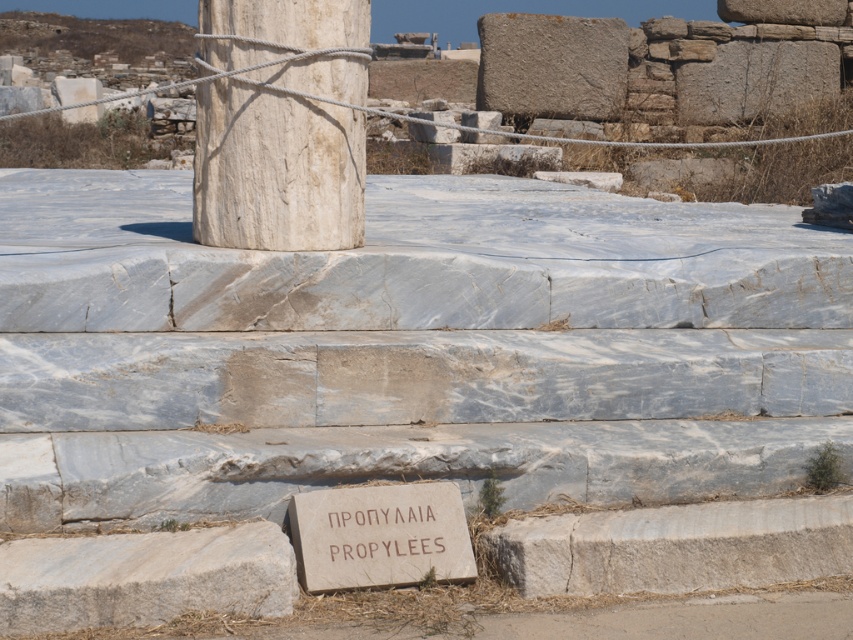
Question: Among these points, which one is farthest from the camera?

Choices:
 (A) (326, 225)
 (B) (302, 518)

Answer: (A)

Question: From the image, what is the correct spatial relationship of white marble column at center in relation to brown stone sign at center?

Choices:
 (A) right
 (B) left

Answer: (B)

Question: Which object is closer to the camera taking this photo?

Choices:
 (A) brown stone sign at center
 (B) white marble column at center

Answer: (A)

Question: Is white marble column at center to the left of brown stone sign at center from the viewer's perspective?

Choices:
 (A) no
 (B) yes

Answer: (B)

Question: Among these objects, which one is farthest from the camera?

Choices:
 (A) brown stone sign at center
 (B) white marble column at center

Answer: (B)

Question: Where is white marble column at center located in relation to brown stone sign at center in the image?

Choices:
 (A) left
 (B) right

Answer: (A)